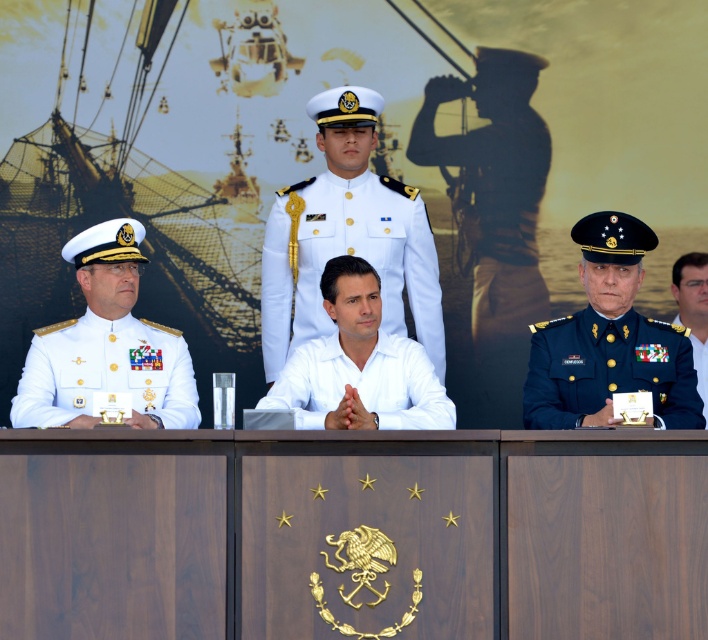
Question: Does white glossy uniform at center come in front of dark green military uniform at right?

Choices:
 (A) yes
 (B) no

Answer: (B)

Question: Which point is closer to the camera?

Choices:
 (A) (411, 355)
 (B) (326, 179)
 (C) (670, 374)

Answer: (C)

Question: Is white glossy uniform at center to the left of dark blue fabric military uniform at right from the viewer's perspective?

Choices:
 (A) no
 (B) yes

Answer: (B)

Question: Which object appears farthest from the camera in this image?

Choices:
 (A) white matte shirt at center
 (B) dark green military uniform at right
 (C) dark blue fabric military uniform at right

Answer: (C)

Question: Can you confirm if white matte shirt at center is smaller than dark blue fabric military uniform at right?

Choices:
 (A) no
 (B) yes

Answer: (A)

Question: Which is farther from the white glossy uniform at center?

Choices:
 (A) white uniform at center
 (B) dark blue fabric military uniform at right
 (C) white matte shirt at center

Answer: (B)